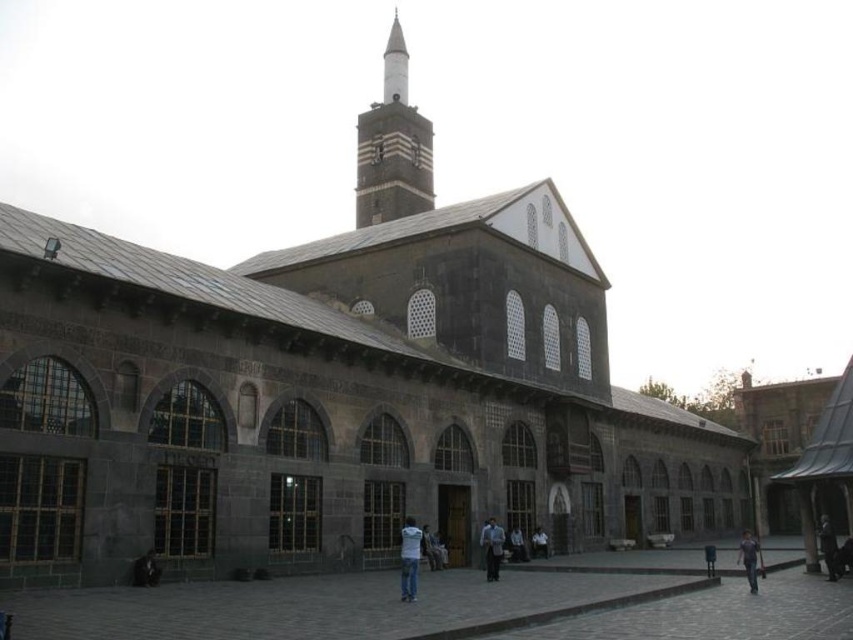
Who is shorter, white cotton shirt at center or light blue fabric shirt at center?

light blue fabric shirt at center

Does white cotton shirt at center appear on the left side of light blue fabric shirt at center?

Yes, white cotton shirt at center is to the left of light blue fabric shirt at center.

The width and height of the screenshot is (853, 640). Identify the location of white cotton shirt at center. (409, 557).

Locate an element on the screen. white cotton shirt at center is located at coordinates (409, 557).

Is dark brown stone minaret at center above dark gray fabric coat at lower right?

Yes, dark brown stone minaret at center is above dark gray fabric coat at lower right.

Where is `dark brown stone minaret at center`? This screenshot has width=853, height=640. dark brown stone minaret at center is located at coordinates (392, 147).

The image size is (853, 640). What do you see at coordinates (392, 147) in the screenshot? I see `dark brown stone minaret at center` at bounding box center [392, 147].

What are the coordinates of `dark brown stone minaret at center` in the screenshot? It's located at (392, 147).

Which is more to the right, light blue fabric shirt at center or light blue denim jacket at center?

Positioned to the right is light blue denim jacket at center.

Can you confirm if light blue fabric shirt at center is shorter than light blue denim jacket at center?

Incorrect, light blue fabric shirt at center's height does not fall short of light blue denim jacket at center's.

This screenshot has width=853, height=640. I want to click on light blue fabric shirt at center, so click(517, 545).

I want to click on light blue fabric shirt at center, so click(x=517, y=545).